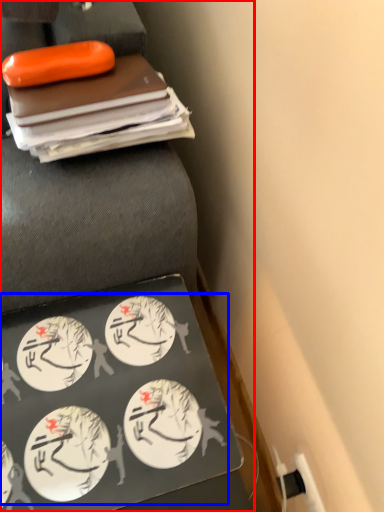
Question: Which object is further to the camera taking this photo, furniture (highlighted by a red box) or food (highlighted by a blue box)?

Choices:
 (A) furniture
 (B) food

Answer: (B)